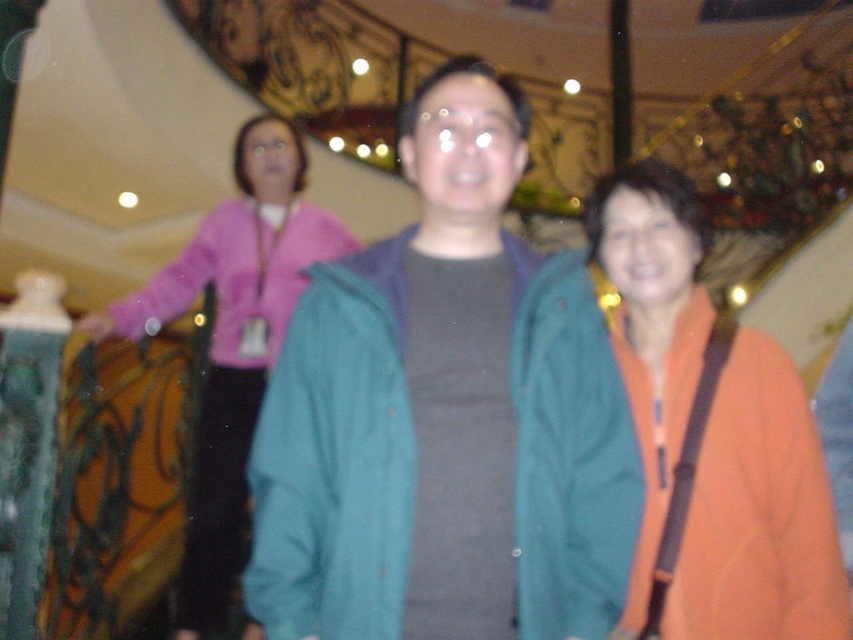
You are taking a photo of two points in the scene. The first point is at coordinate point (666,186) and the second is at point (305,220). Which point is closer to your camera?

Point (666,186) is closer to the camera than point (305,220).

You are standing in a public space and see two pieces of clothing. One is an orange fabric at right and the other is a pink fabric jacket at upper left. Which clothing item is positioned more to the east side of the scene?

The orange fabric at right is to the right of the pink fabric jacket at upper left, so it is positioned more to the east side of the scene.

You are an interior designer assessing the color balance in this indoor space. You notice the orange fabric at right and the pink fabric at upper left. Which fabric takes up more visual space in the scene?

The pink fabric at upper left occupies more visual space than the orange fabric at right.